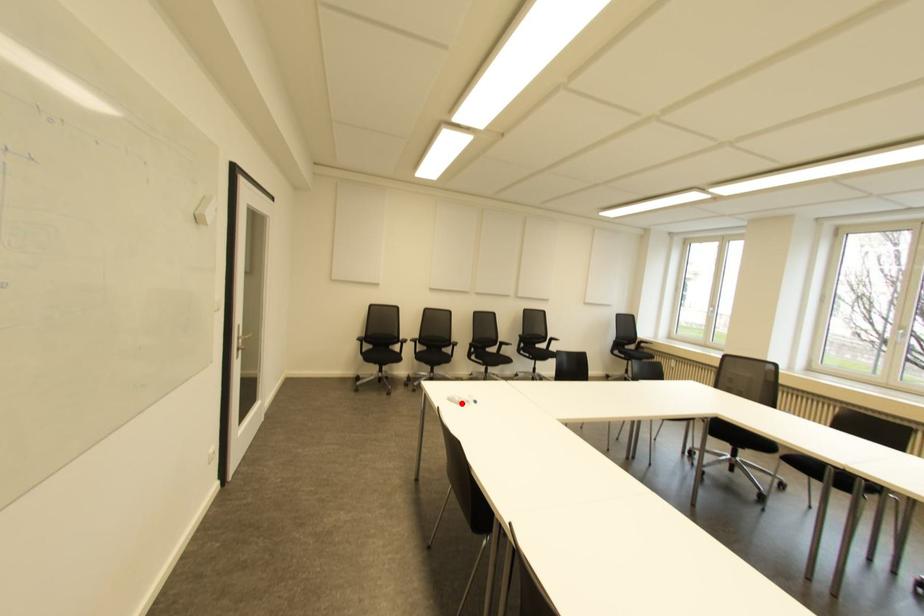
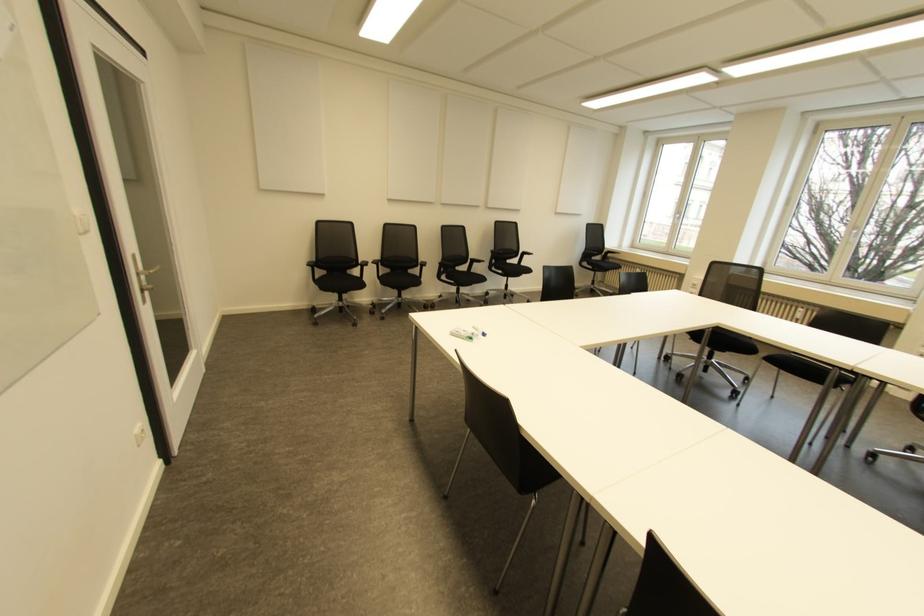
Question: A red point is marked in image1. In image2, is the corresponding 3D point closer to the camera or farther? Reply with the corresponding letter.

Choices:
 (A) The corresponding 3D point is closer.
 (B) The corresponding 3D point is farther.

Answer: (B)